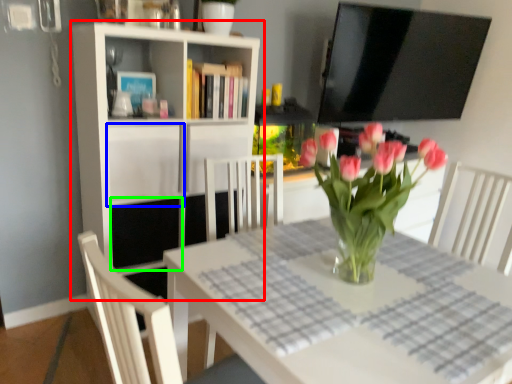
Question: Which object is the farthest from shelf (highlighted by a red box)? Choose among these: cabinet (highlighted by a blue box) or shelf (highlighted by a green box).

Choices:
 (A) cabinet
 (B) shelf

Answer: (B)